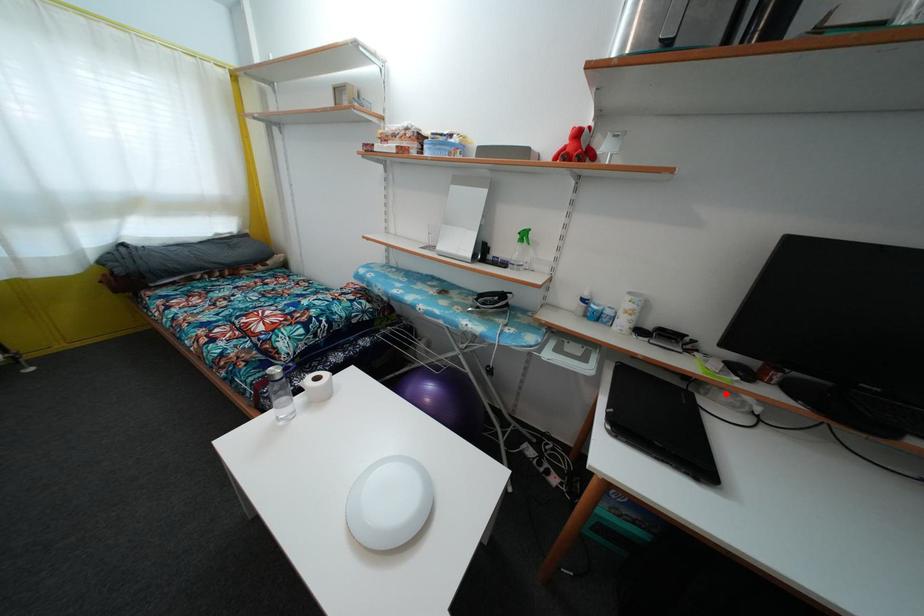
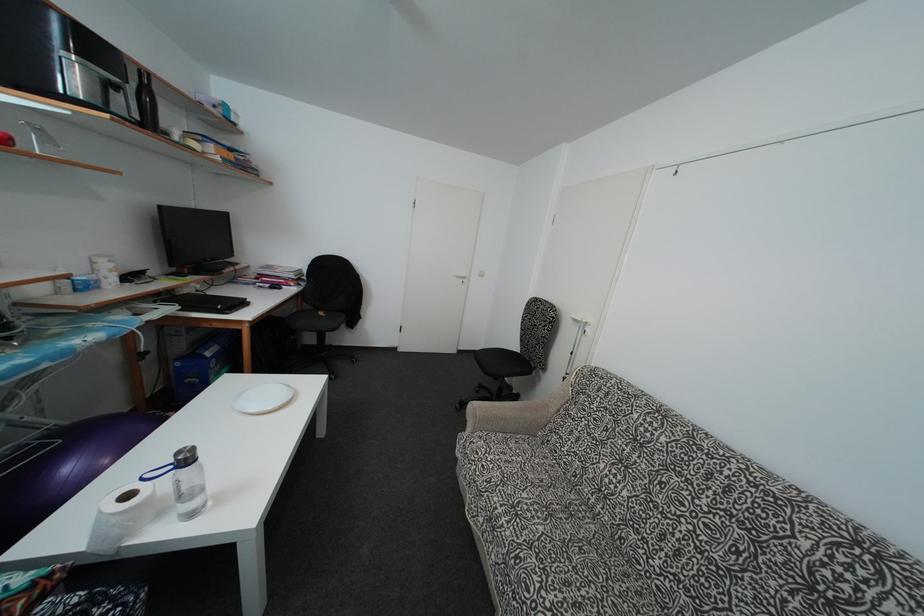
Where in the second image is the point corresponding to the highlighted location from the first image?

(185, 294)